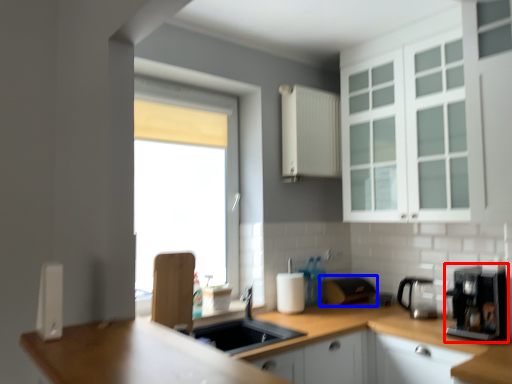
Question: Which object is closer to the camera taking this photo, coffee machine (highlighted by a red box) or appliance (highlighted by a blue box)?

Choices:
 (A) coffee machine
 (B) appliance

Answer: (A)